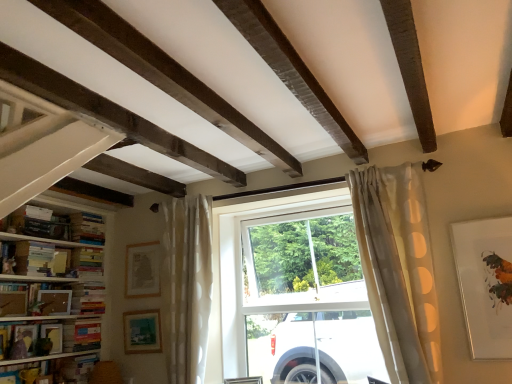
Question: Can you confirm if hardcover books at left, which is the 3th book in top-to-bottom order, is bigger than hardcover books at left, which is counted as the 5th book, starting from the bottom?

Choices:
 (A) no
 (B) yes

Answer: (A)

Question: From the image's perspective, would you say hardcover books at left, which is the 3th book in top-to-bottom order, is shown under hardcover books at left, placed as the 4th book when sorted from top to bottom?

Choices:
 (A) no
 (B) yes

Answer: (A)

Question: Is hardcover books at left, placed as the 6th book when sorted from bottom to top, positioned far away from hardcover books at left, which is counted as the 5th book, starting from the bottom?

Choices:
 (A) yes
 (B) no

Answer: (B)

Question: From a real-world perspective, is hardcover books at left, placed as the 6th book when sorted from bottom to top, beneath hardcover books at left, placed as the 4th book when sorted from top to bottom?

Choices:
 (A) no
 (B) yes

Answer: (B)

Question: Is hardcover books at left, placed as the 6th book when sorted from bottom to top, facing towards hardcover books at left, placed as the 4th book when sorted from top to bottom?

Choices:
 (A) no
 (B) yes

Answer: (A)

Question: Is matte wooden picture frame at lower left, the 2th picture frame when ordered from right to left, in front of or behind hardcover books at left, placed as the 4th book when sorted from top to bottom, in the image?

Choices:
 (A) behind
 (B) front

Answer: (B)

Question: From the image's perspective, is matte wooden picture frame at lower left, the 4th picture frame viewed from the left, located above or below hardcover books at left, placed as the 4th book when sorted from top to bottom?

Choices:
 (A) below
 (B) above

Answer: (A)

Question: Visually, is matte wooden picture frame at lower left, the 2th picture frame when ordered from back to front, positioned to the left or to the right of hardcover books at left, placed as the 4th book when sorted from top to bottom?

Choices:
 (A) left
 (B) right

Answer: (B)

Question: Is matte wooden picture frame at lower left, the 2th picture frame when ordered from right to left, wider or thinner than hardcover books at left, placed as the 4th book when sorted from top to bottom?

Choices:
 (A) wide
 (B) thin

Answer: (B)

Question: From the image's perspective, is hardcover books at left, which is the 2th book from top to bottom, above or below white polka dot fabric at right, the second curtain from the back?

Choices:
 (A) below
 (B) above

Answer: (B)

Question: In terms of size, does hardcover books at left, which is the 2th book from top to bottom, appear bigger or smaller than white polka dot fabric at right, the second curtain from the back?

Choices:
 (A) big
 (B) small

Answer: (B)

Question: Considering the positions of hardcover books at left, which is the 2th book from top to bottom, and white polka dot fabric at right, the second curtain from the back, in the image, is hardcover books at left, which is the 2th book from top to bottom, taller or shorter than white polka dot fabric at right, the second curtain from the back,?

Choices:
 (A) short
 (B) tall

Answer: (A)

Question: Does point (90, 215) appear closer or farther from the camera than point (409, 342)?

Choices:
 (A) closer
 (B) farther

Answer: (B)

Question: Is matte white picture frame at upper right, which ranks as the first picture frame in front-to-back order, situated inside hardcover book at left, which is counted as the 2th book, starting from the bottom, or outside?

Choices:
 (A) outside
 (B) inside

Answer: (A)

Question: Considering the positions of matte white picture frame at upper right, the 5th picture frame from the back, and hardcover book at left, which is counted as the 2th book, starting from the bottom, in the image, is matte white picture frame at upper right, the 5th picture frame from the back, wider or thinner than hardcover book at left, which is counted as the 2th book, starting from the bottom,?

Choices:
 (A) wide
 (B) thin

Answer: (B)